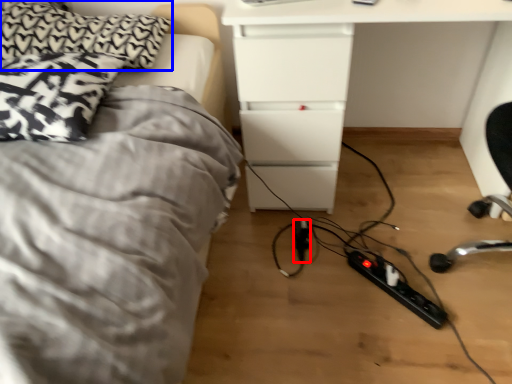
Question: Which object is closer to the camera taking this photo, extension cord (highlighted by a red box) or pillow (highlighted by a blue box)?

Choices:
 (A) extension cord
 (B) pillow

Answer: (B)